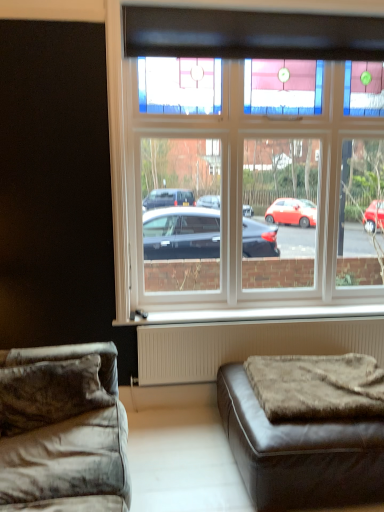
Question: Is white plastic window sill at lower center looking in the opposite direction of brown leather ottoman at lower right, the second studio couch from the left?

Choices:
 (A) yes
 (B) no

Answer: (B)

Question: Is white plastic window sill at lower center positioned behind brown leather ottoman at lower right, the second studio couch from the left?

Choices:
 (A) no
 (B) yes

Answer: (B)

Question: Can you confirm if white plastic window sill at lower center is positioned to the left of brown leather ottoman at lower right, positioned as the first studio couch in right-to-left order?

Choices:
 (A) no
 (B) yes

Answer: (B)

Question: Is brown leather ottoman at lower right, positioned as the first studio couch in right-to-left order, surrounded by white plastic window sill at lower center?

Choices:
 (A) yes
 (B) no

Answer: (B)

Question: From a real-world perspective, is white plastic window sill at lower center over brown leather ottoman at lower right, the second studio couch from the left?

Choices:
 (A) yes
 (B) no

Answer: (A)

Question: Is the surface of white plastic window sill at lower center in direct contact with brown leather ottoman at lower right, the second studio couch from the left?

Choices:
 (A) yes
 (B) no

Answer: (B)

Question: Is the position of clear glass window at upper center less distant than that of velvet gray couch at lower left, the 2th studio couch when ordered from right to left?

Choices:
 (A) no
 (B) yes

Answer: (A)

Question: From the image's perspective, would you say clear glass window at upper center is shown under velvet gray couch at lower left, which ranks as the first studio couch in left-to-right order?

Choices:
 (A) no
 (B) yes

Answer: (A)

Question: From the image's perspective, is clear glass window at upper center on top of velvet gray couch at lower left, the 2th studio couch when ordered from right to left?

Choices:
 (A) no
 (B) yes

Answer: (B)

Question: Are clear glass window at upper center and velvet gray couch at lower left, which ranks as the first studio couch in left-to-right order, far apart?

Choices:
 (A) no
 (B) yes

Answer: (B)

Question: Considering the relative sizes of clear glass window at upper center and velvet gray couch at lower left, which ranks as the first studio couch in left-to-right order, in the image provided, is clear glass window at upper center thinner than velvet gray couch at lower left, which ranks as the first studio couch in left-to-right order,?

Choices:
 (A) yes
 (B) no

Answer: (A)

Question: Does clear glass window at upper center appear on the right side of velvet gray couch at lower left, which ranks as the first studio couch in left-to-right order?

Choices:
 (A) yes
 (B) no

Answer: (A)

Question: Is brown fuzzy mattress at lower right wider than velvet gray couch at lower left, which ranks as the first studio couch in left-to-right order?

Choices:
 (A) no
 (B) yes

Answer: (A)